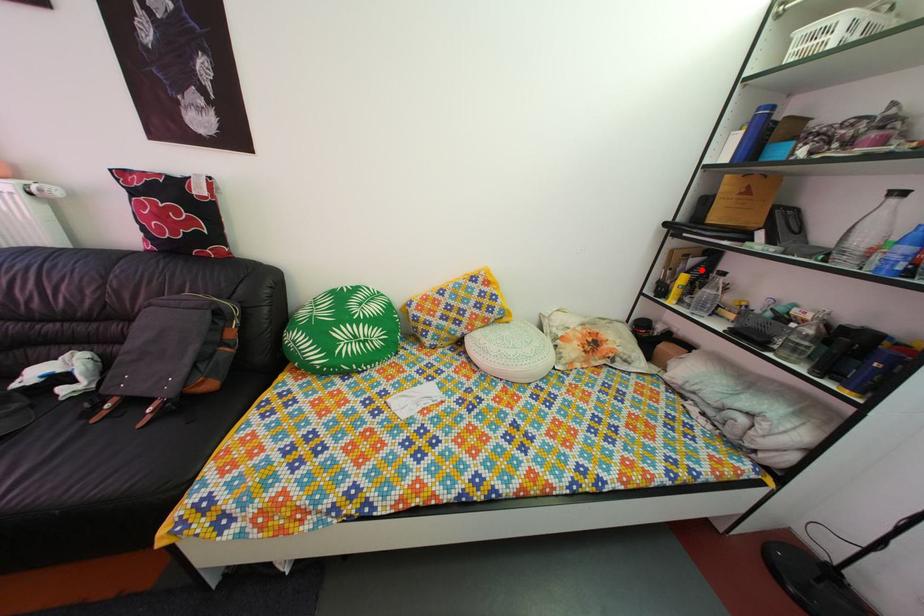
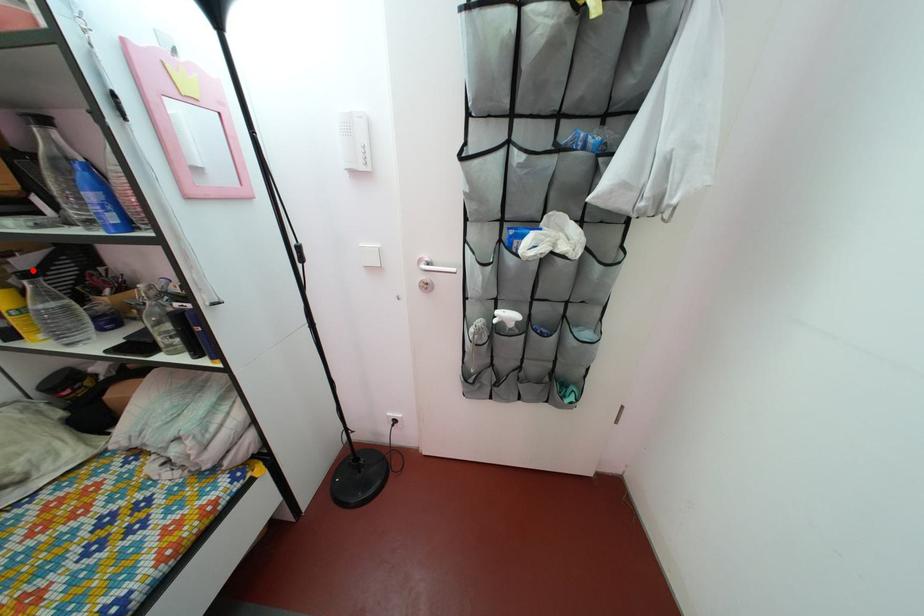
I am providing you with two images of the same scene from different viewpoints. A red point is marked on the first image and another point is marked on the second image. Are the points marked in image1 and image2 representing the same 3D position?

Yes